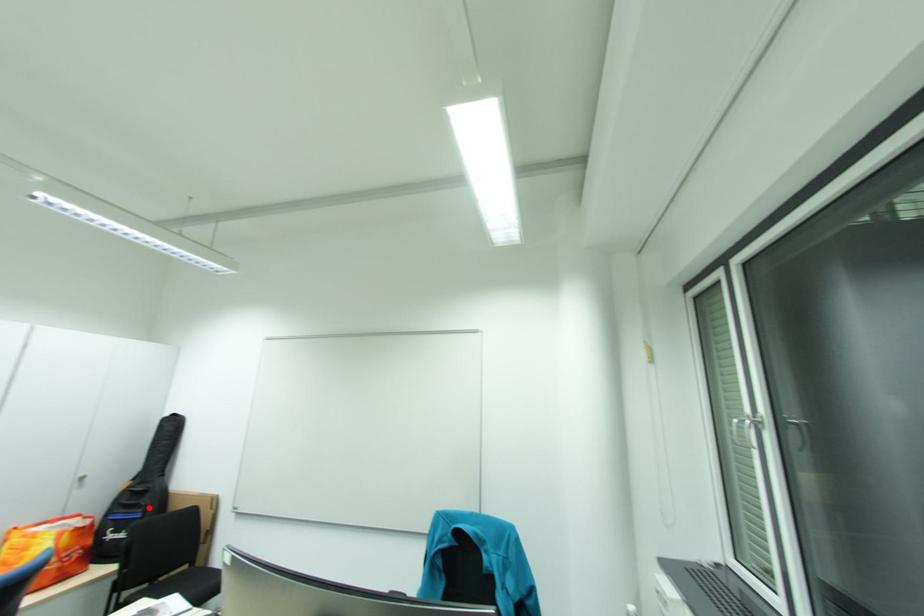
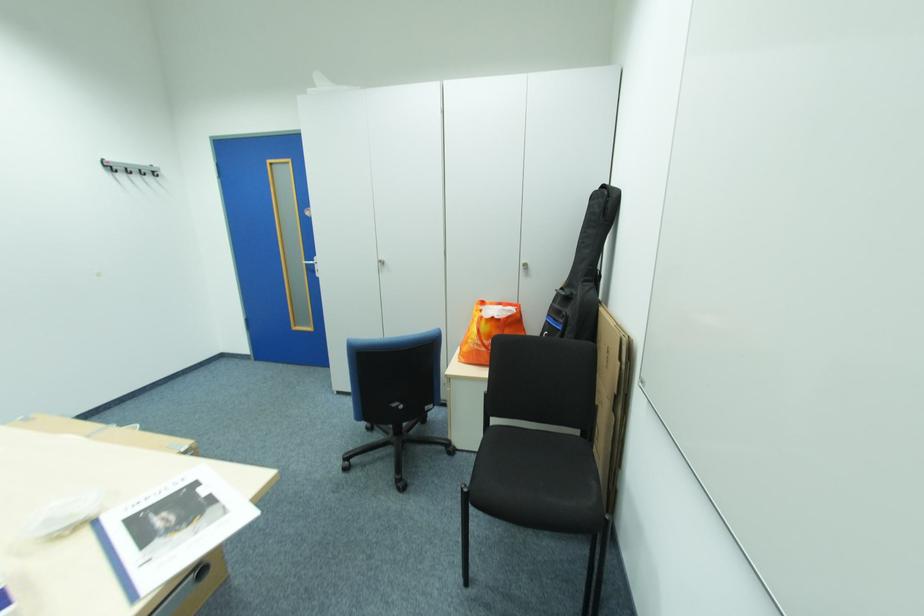
Locate, in the second image, the point that corresponds to the highlighted location in the first image.

(572, 318)